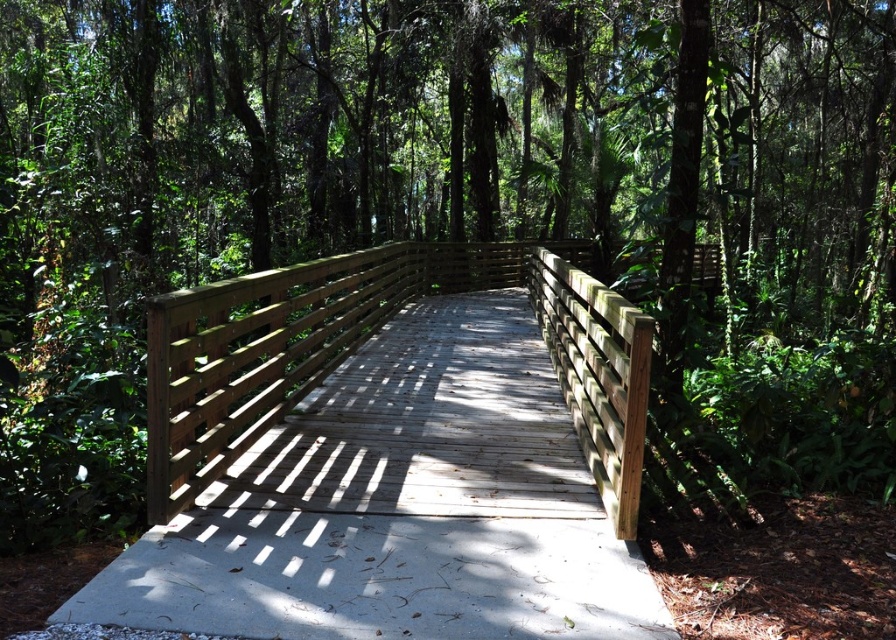
You are standing on the wooden boardwalk in the forest and notice two points marked on the boardwalk. The first point is at coordinates point (599, 353) and the second is at point (589, 346). If you want to move towards the point that is closer to you, which coordinate should you head towards?

You should head towards point (599, 353) because it is closer to the viewer than point (589, 346).

You are standing at the start of the boardwalk and want to cross the wooden bridge at center. Based on its position, can you estimate how far along the boardwalk you need to walk to reach the bridge?

The wooden bridge at center is located at point coordinates 0.533 along the x and 0.408 along the y. This means you need to walk approximately halfway along the boardwalk to reach the bridge.

You are a hiker carrying a large backpack and need to cross the wooden bridge at center and the natural wood fence at center. Which structure can you pass through without needing to remove your backpack?

The wooden bridge at center has a larger size compared to natural wood fence at center, so you can pass through the wooden bridge at center without removing your backpack, but the natural wood fence at center may require adjusting or removing your backpack due to its smaller size.